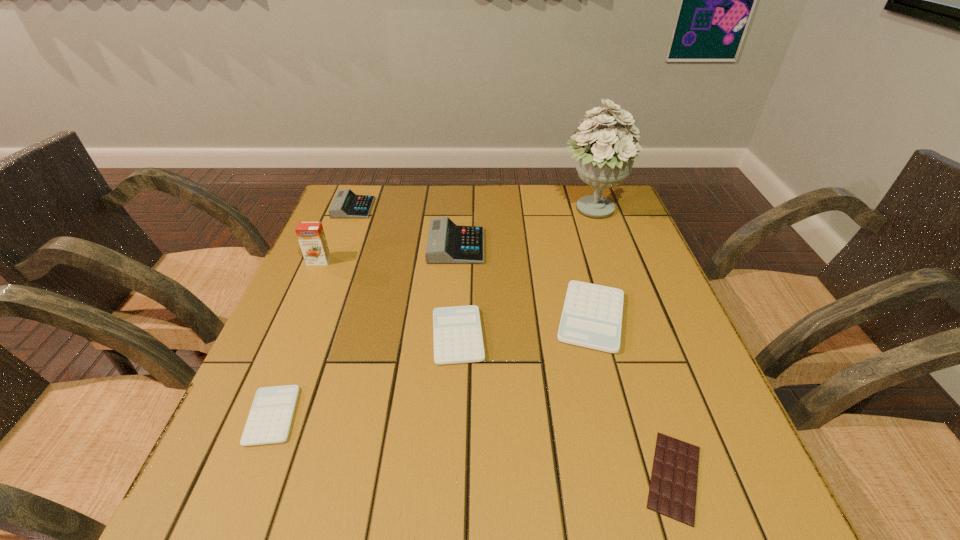
This screenshot has height=540, width=960. I want to click on vacant space in between the chocolate bar and the nearest calculator, so click(473, 446).

Identify the location of vacant area that lies between the bouquet and the smaller gray calculator. The width and height of the screenshot is (960, 540). (472, 209).

Where is `vacant area that lies between the second shortest object and the brown chocolate bar`? The image size is (960, 540). vacant area that lies between the second shortest object and the brown chocolate bar is located at coordinates (473, 446).

Find the location of a particular element. This screenshot has height=540, width=960. vacant area between the brown chocolate bar and the right gray calculator is located at coordinates (565, 361).

I want to click on free space between the second smallest white calculator and the tallest calculator, so click(x=457, y=291).

I want to click on vacant space in between the nearest calculator and the fourth tallest object, so click(x=313, y=312).

What are the coordinates of `free point between the second white calculator from left to right and the fourth shortest object` in the screenshot? It's located at pyautogui.click(x=525, y=326).

Locate an element on the screen. This screenshot has height=540, width=960. vacant point located between the seventh tallest object and the biggest white calculator is located at coordinates (432, 366).

Locate an element on the screen. free space between the bigger gray calculator and the shortest object is located at coordinates (565, 361).

Where is `object that is the third nearest to the smaller gray calculator`? This screenshot has width=960, height=540. object that is the third nearest to the smaller gray calculator is located at coordinates (457, 334).